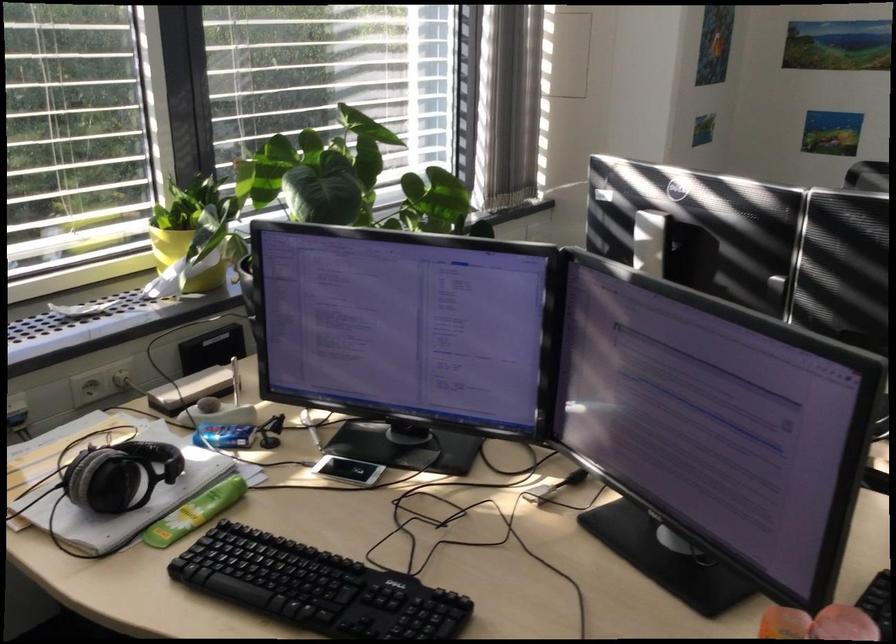
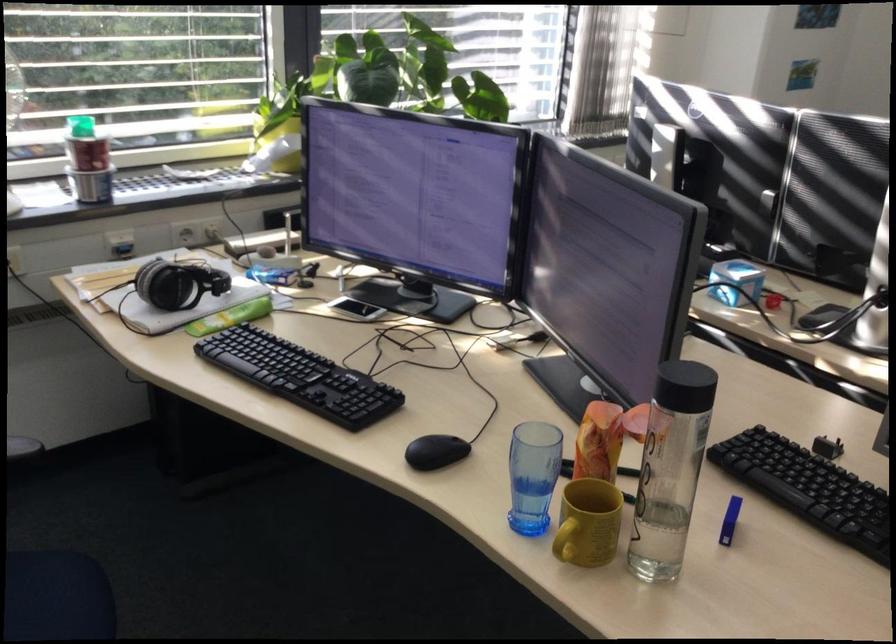
In the second image, find the point that corresponds to point 124,480 in the first image.

(177, 283)